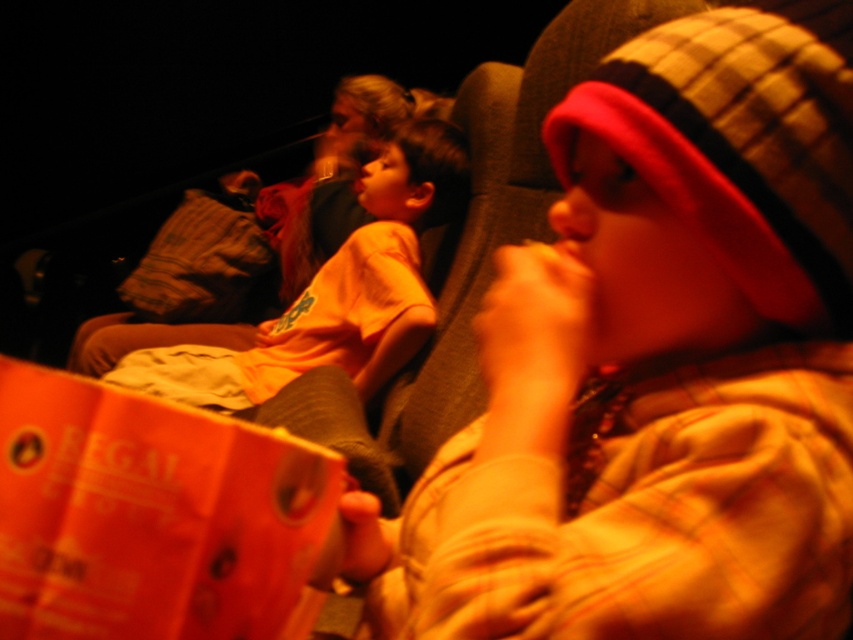
Question: Can you confirm if plaid fabric hat at upper right is smaller than orange cotton shirt at center?

Choices:
 (A) no
 (B) yes

Answer: (B)

Question: Which object appears farthest from the camera in this image?

Choices:
 (A) orange paper at center
 (B) matte orange shirt at center
 (C) plaid fabric hat at upper right

Answer: (C)

Question: Can you confirm if matte orange shirt at center is positioned to the right of orange cotton shirt at center?

Choices:
 (A) no
 (B) yes

Answer: (B)

Question: Which of the following is the closest to the observer?

Choices:
 (A) plaid fabric hat at upper right
 (B) matte orange shirt at center
 (C) orange paper at center
 (D) orange cotton shirt at center

Answer: (C)

Question: Observing the image, what is the correct spatial positioning of matte orange shirt at center in reference to orange cotton shirt at center?

Choices:
 (A) left
 (B) right

Answer: (B)

Question: Among these points, which one is nearest to the camera?

Choices:
 (A) (839, 4)
 (B) (810, 253)

Answer: (B)